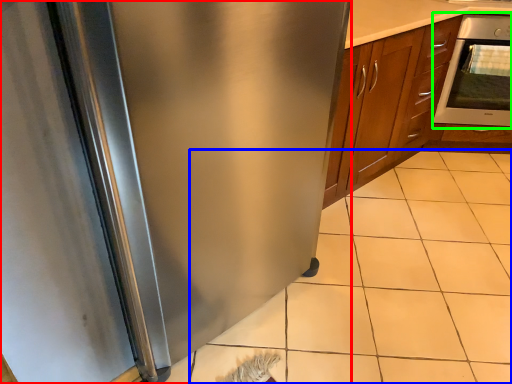
Question: Which is farther away from refrigerator (highlighted by a red box)? tile (highlighted by a blue box) or oven (highlighted by a green box)?

Choices:
 (A) tile
 (B) oven

Answer: (B)